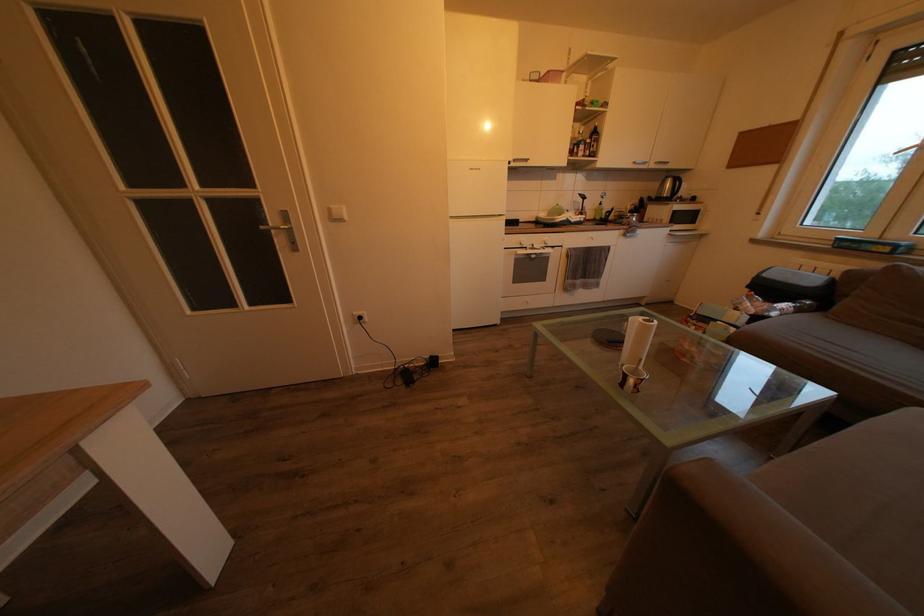
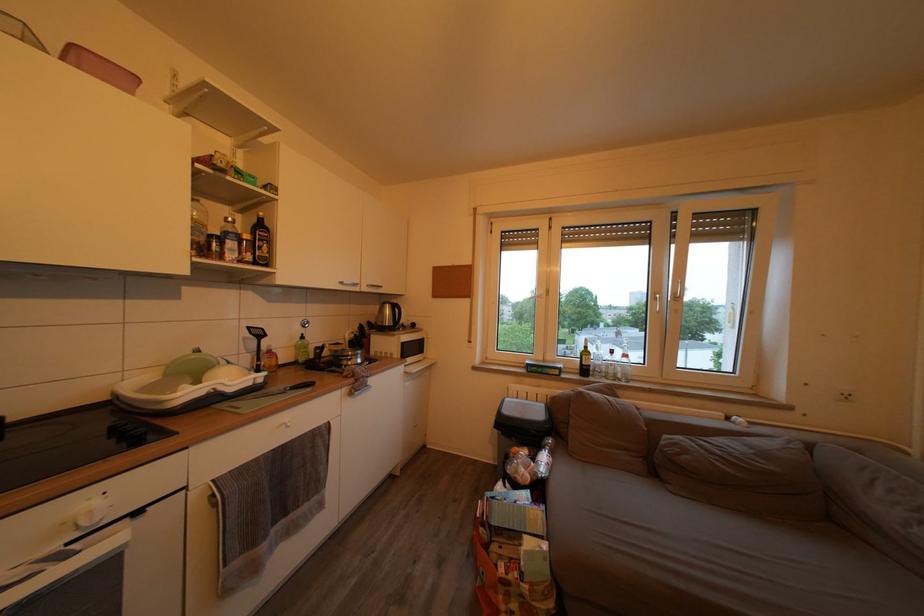
Find the pixel in the second image that matches the point at 579,146 in the first image.

(205, 230)